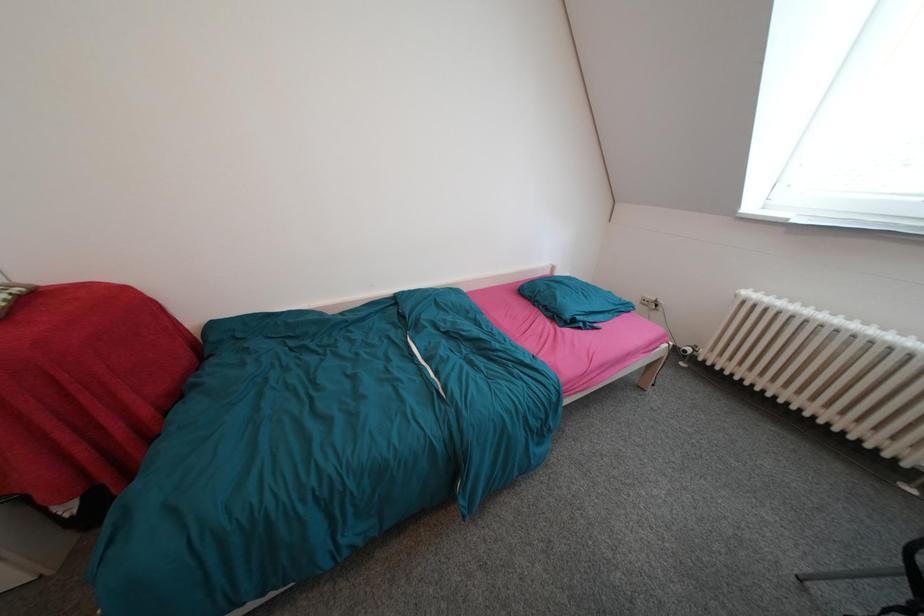
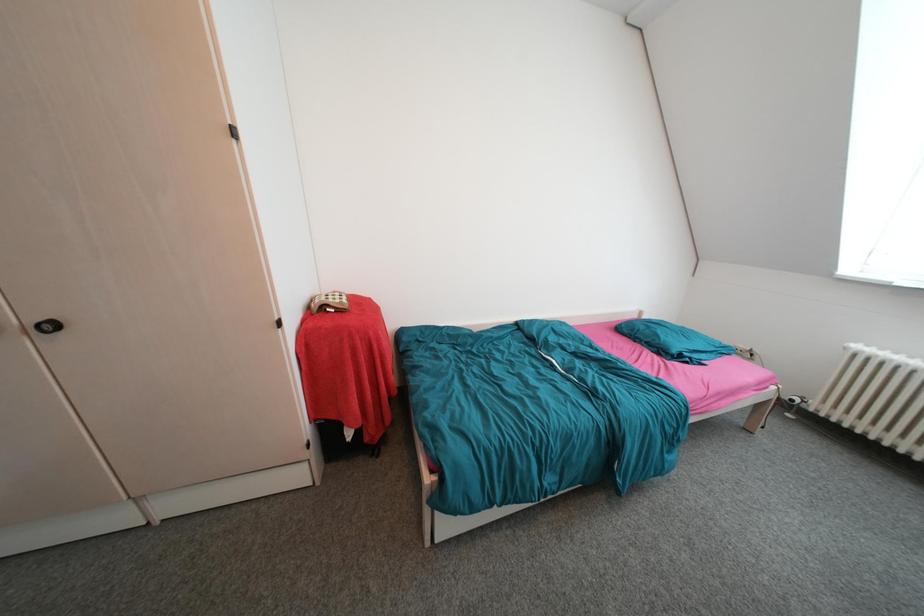
Question: The images are taken continuously from a first-person perspective. In which direction is your viewpoint rotating?

Choices:
 (A) Left
 (B) Right
 (C) Up
 (D) Down

Answer: (C)